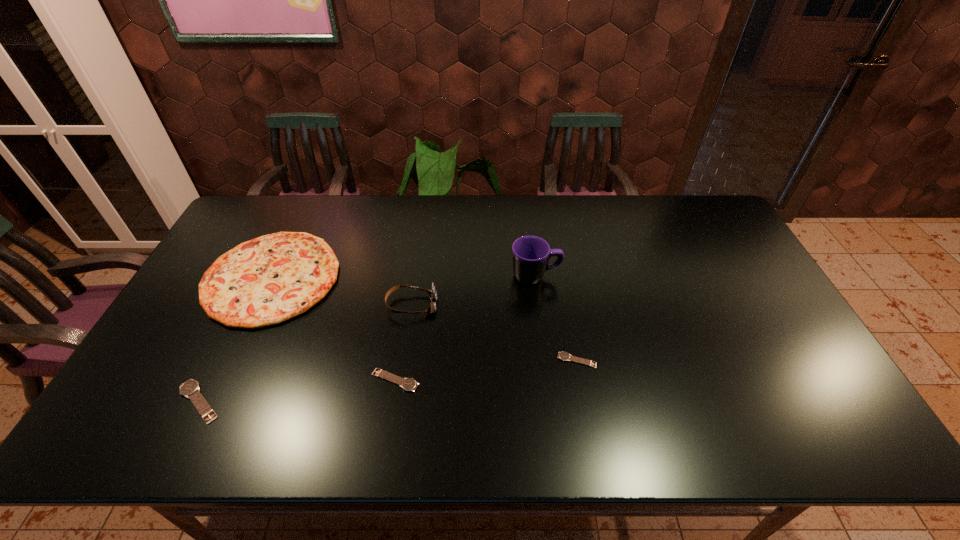
The image size is (960, 540). I want to click on vacant position located on the back of the second watch from left to right, so click(409, 289).

Find the location of a particular element. vacant area situated on the right of the rightmost watch is located at coordinates (669, 360).

Where is `vacant region located 0.220m on the back of the fourth shortest object`? vacant region located 0.220m on the back of the fourth shortest object is located at coordinates (309, 198).

Identify the location of vacant space located 0.340m with the handle on the side of the tallest object. (670, 276).

Image resolution: width=960 pixels, height=540 pixels. What are the coordinates of `vacant space situated 0.390m on the front-facing side of the goggles` in the screenshot? It's located at (570, 305).

Find the location of a particular element. The height and width of the screenshot is (540, 960). object that is at the far edge is located at coordinates (265, 281).

This screenshot has width=960, height=540. Find the location of `watch present at the left edge`. watch present at the left edge is located at coordinates (190, 389).

Where is `pizza located at the left edge`? The image size is (960, 540). pizza located at the left edge is located at coordinates (265, 281).

Where is `object at the far left corner`? This screenshot has width=960, height=540. object at the far left corner is located at coordinates (265, 281).

The width and height of the screenshot is (960, 540). I want to click on object that is at the near left corner, so click(190, 389).